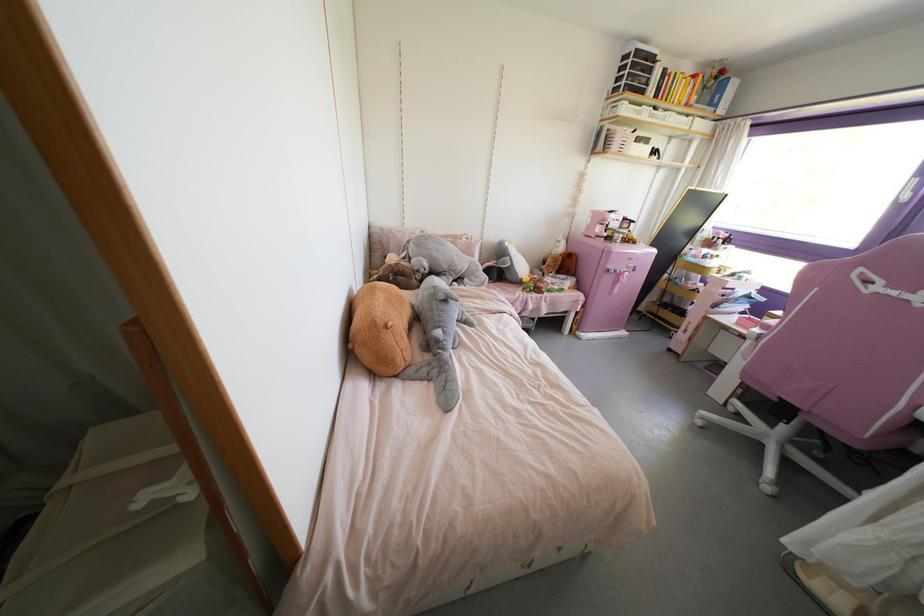
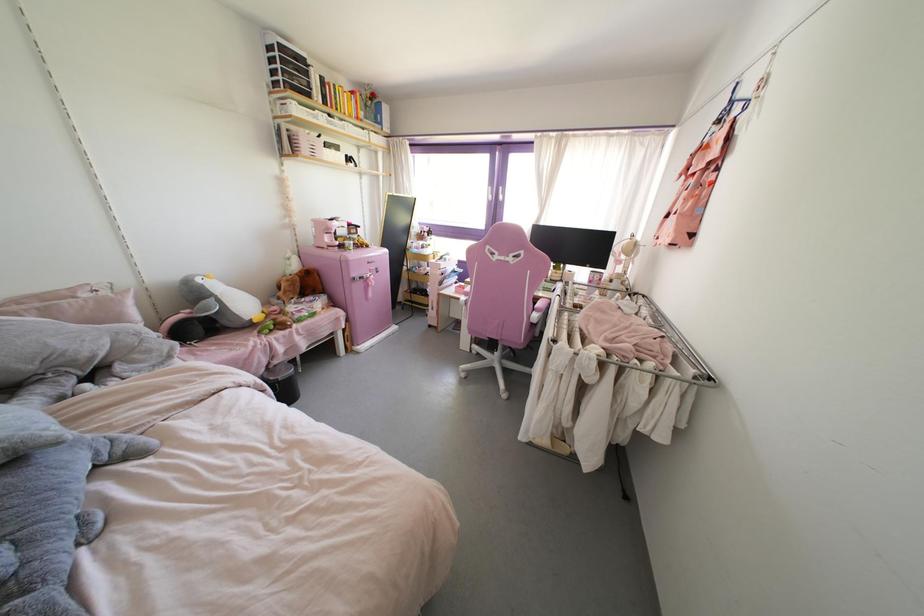
Locate, in the second image, the point that corresponds to point (523, 280) in the first image.

(254, 320)